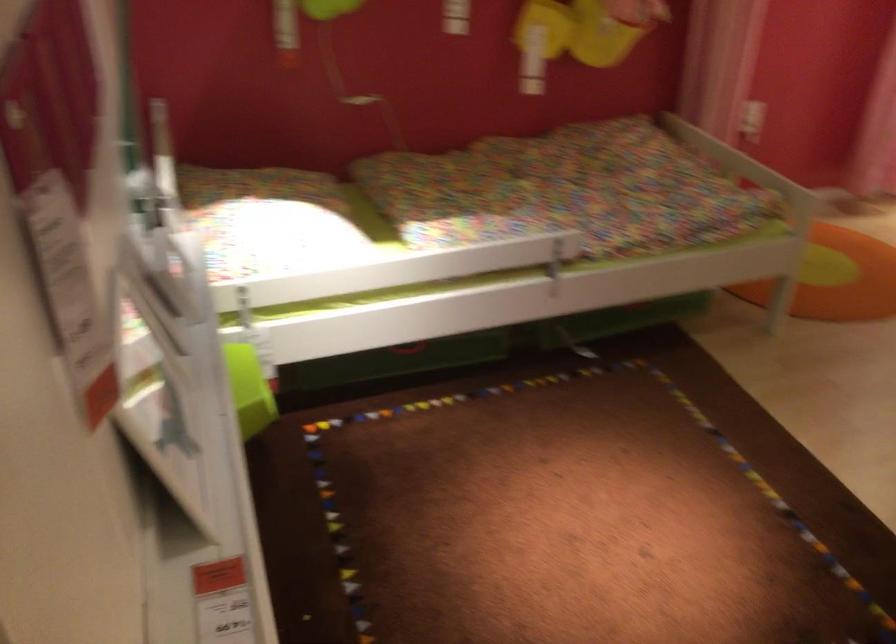
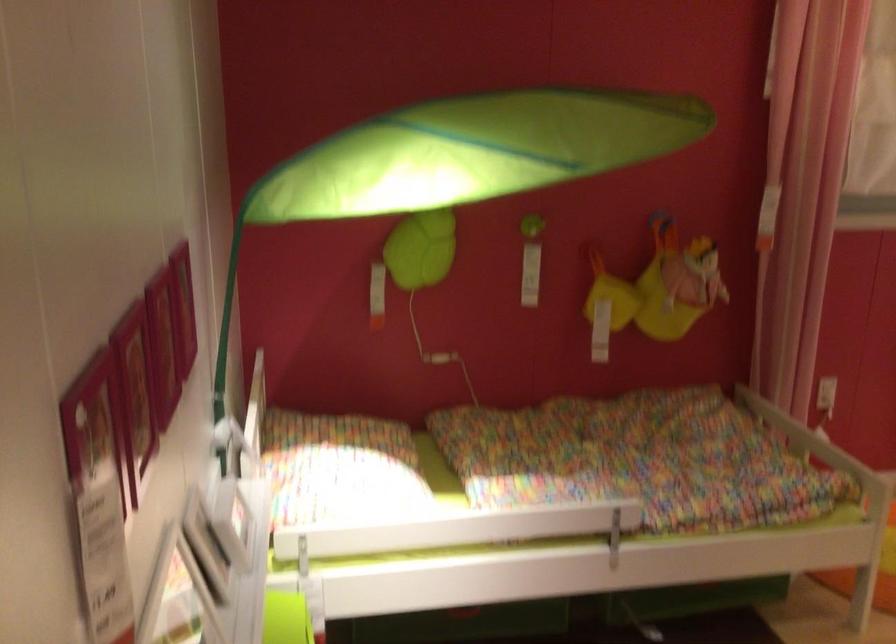
Locate, in the second image, the point that corresponds to point (122, 73) in the first image.

(226, 339)